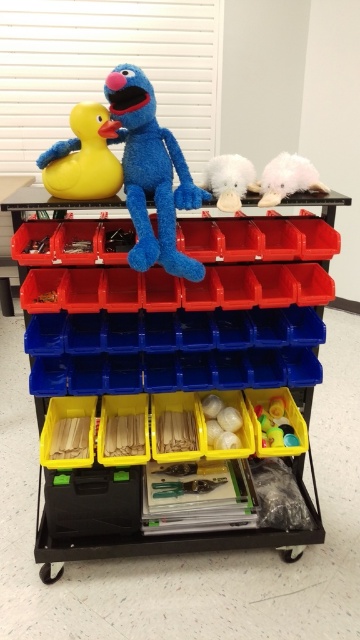
Does blue plush toy at center come behind white fluffy toy at upper right?

That is False.

Where is `blue plush toy at center`? The image size is (360, 640). blue plush toy at center is located at coordinates (150, 173).

Between yellow rubber duck at upper left and white fluffy toy at upper right, which one has more height?

Standing taller between the two is yellow rubber duck at upper left.

Is yellow rubber duck at upper left wider than white fluffy toy at upper right?

Yes.

What are the coordinates of `yellow rubber duck at upper left` in the screenshot? It's located at (86, 157).

Does yellow rubber duck at upper left lie in front of fluffy white cloud at upper right?

Yes, it is in front of fluffy white cloud at upper right.

What do you see at coordinates (86, 157) in the screenshot? I see `yellow rubber duck at upper left` at bounding box center [86, 157].

Which is behind, point (83, 166) or point (261, 173)?

The point (261, 173) is behind.

Identify the location of yellow rubber duck at upper left. (86, 157).